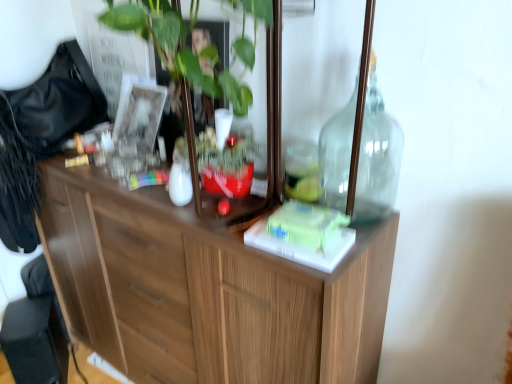
Question: Considering the relative sizes of black plastic swivel chair at lower left and transparent glass bottle at upper right in the image provided, is black plastic swivel chair at lower left taller than transparent glass bottle at upper right?

Choices:
 (A) no
 (B) yes

Answer: (A)

Question: Would you say black plastic swivel chair at lower left contains transparent glass bottle at upper right?

Choices:
 (A) yes
 (B) no

Answer: (B)

Question: Is black plastic swivel chair at lower left outside transparent glass bottle at upper right?

Choices:
 (A) no
 (B) yes

Answer: (B)

Question: Does black plastic swivel chair at lower left have a smaller size compared to transparent glass bottle at upper right?

Choices:
 (A) no
 (B) yes

Answer: (A)

Question: Can you confirm if black plastic swivel chair at lower left is bigger than transparent glass bottle at upper right?

Choices:
 (A) yes
 (B) no

Answer: (A)

Question: Could you tell me if black plastic swivel chair at lower left is facing transparent glass bottle at upper right?

Choices:
 (A) no
 (B) yes

Answer: (A)

Question: Is black plastic swivel chair at lower left oriented towards wooden cabinet at center?

Choices:
 (A) yes
 (B) no

Answer: (B)

Question: From a real-world perspective, is black plastic swivel chair at lower left located higher than wooden cabinet at center?

Choices:
 (A) no
 (B) yes

Answer: (A)

Question: Is the depth of black plastic swivel chair at lower left less than that of wooden cabinet at center?

Choices:
 (A) no
 (B) yes

Answer: (A)

Question: Would you say black plastic swivel chair at lower left is outside wooden cabinet at center?

Choices:
 (A) yes
 (B) no

Answer: (A)

Question: Is wooden cabinet at center surrounded by black plastic swivel chair at lower left?

Choices:
 (A) yes
 (B) no

Answer: (B)

Question: Is black plastic swivel chair at lower left far away from wooden cabinet at center?

Choices:
 (A) yes
 (B) no

Answer: (B)

Question: Is transparent glass bottle at upper right bigger than wooden cabinet at center?

Choices:
 (A) yes
 (B) no

Answer: (B)